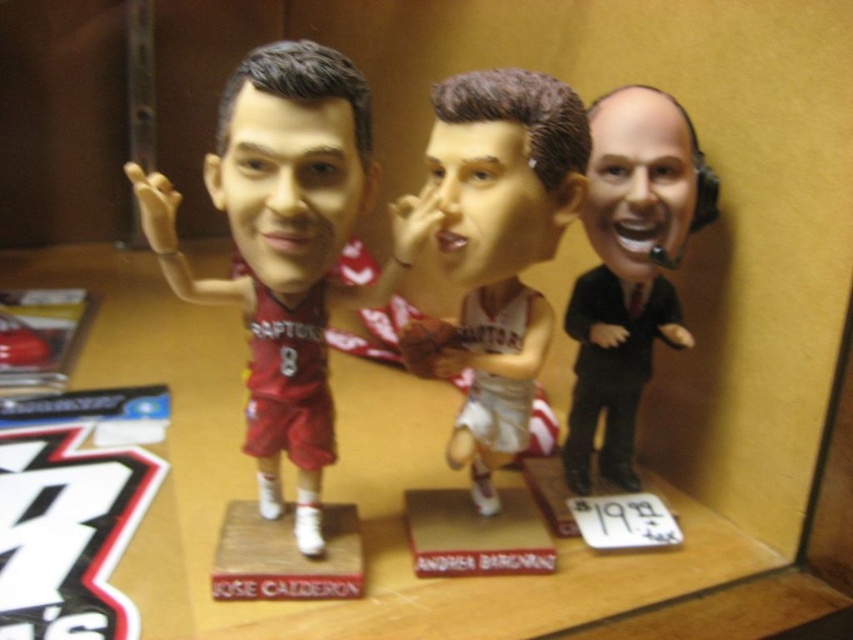
Which of these two, matte plastic bobblehead at center or black suit at right, stands taller?

matte plastic bobblehead at center

Is the position of matte plastic bobblehead at center less distant than that of black suit at right?

Yes, it is.

Between point (281, 310) and point (641, 164), which one is positioned behind?

The point (641, 164) is more distant.

This screenshot has width=853, height=640. Find the location of `matte plastic bobblehead at center`. matte plastic bobblehead at center is located at coordinates (287, 248).